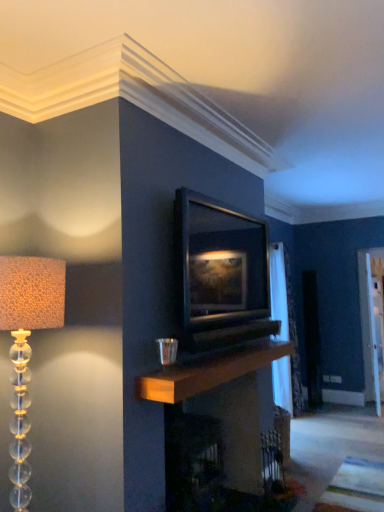
The image size is (384, 512). Find the location of `white sheer curtain at right`. white sheer curtain at right is located at coordinates (285, 333).

This screenshot has height=512, width=384. Describe the element at coordinates (209, 370) in the screenshot. I see `wooden mantle at center` at that location.

Find the location of a particular element. The width and height of the screenshot is (384, 512). wooden mantle at center is located at coordinates (209, 370).

This screenshot has height=512, width=384. In order to click on matte black picture frame at center in this screenshot , I will do `click(220, 273)`.

Can you confirm if transparent glass door at right is shorter than translucent glass lampshade at left?

No.

Is transparent glass door at right looking in the opposite direction of translucent glass lampshade at left?

transparent glass door at right is not turned away from translucent glass lampshade at left.

Is transparent glass door at right at the left side of translucent glass lampshade at left?

No, transparent glass door at right is not to the left of translucent glass lampshade at left.

Is transparent glass door at right far away from translucent glass lampshade at left?

transparent glass door at right is far away from translucent glass lampshade at left.

In the image, is translucent glass lampshade at left positioned in front of or behind matte black picture frame at center?

Visually, translucent glass lampshade at left is located in front of matte black picture frame at center.

From the image's perspective, is translucent glass lampshade at left located above or below matte black picture frame at center?

Based on their image positions, translucent glass lampshade at left is located beneath matte black picture frame at center.

Does translucent glass lampshade at left have a lesser width compared to matte black picture frame at center?

Incorrect, the width of translucent glass lampshade at left is not less than that of matte black picture frame at center.

Would you say translucent glass lampshade at left is inside or outside matte black picture frame at center?

translucent glass lampshade at left is not inside matte black picture frame at center, it's outside.

Looking at this image, from a real-world perspective, is white sheer curtain at right above or below transparent glass door at right?

From a real-world perspective, white sheer curtain at right is physically above transparent glass door at right.

Is point (273, 311) behind point (371, 268)?

No.

Between white sheer curtain at right and transparent glass door at right, which one has less height?

With less height is transparent glass door at right.

Between wooden mantle at center and transparent glass door at right, which one appears on the left side from the viewer's perspective?

wooden mantle at center is more to the left.

Is wooden mantle at center not inside transparent glass door at right?

Yes.

Is wooden mantle at center wider or thinner than transparent glass door at right?

In the image, wooden mantle at center appears to be wider than transparent glass door at right.

Is wooden mantle at center taller or shorter than transparent glass door at right?

Considering their sizes, wooden mantle at center has less height than transparent glass door at right.

Does translucent glass lampshade at left have a greater width compared to transparent glass door at right?

Indeed, translucent glass lampshade at left has a greater width compared to transparent glass door at right.

Can you confirm if translucent glass lampshade at left is positioned to the left of transparent glass door at right?

Yes, translucent glass lampshade at left is to the left of transparent glass door at right.

Which object is more forward, translucent glass lampshade at left or transparent glass door at right?

translucent glass lampshade at left is in front.

Would you consider translucent glass lampshade at left to be distant from transparent glass door at right?

Yes.

Is wooden mantle at center positioned beyond the bounds of translucent glass lampshade at left?

Yes.

From a real-world perspective, is wooden mantle at center above or below translucent glass lampshade at left?

wooden mantle at center is below translucent glass lampshade at left.

Which of these two, wooden mantle at center or translucent glass lampshade at left, is wider?

translucent glass lampshade at left is wider.

Does wooden mantle at center come behind translucent glass lampshade at left?

Yes, wooden mantle at center is behind translucent glass lampshade at left.

Who is more distant, transparent glass door at right or matte black picture frame at center?

transparent glass door at right is further away from the camera.

You are a GUI agent. You are given a task and a screenshot of the screen. Output one action in this format:
    pyautogui.click(x=<x>, y=<y>)
    Task: Click on the glass door located on the right of matte black picture frame at center
    The height and width of the screenshot is (512, 384).
    Given the screenshot: What is the action you would take?
    pyautogui.click(x=372, y=320)

Which object is thinner, transparent glass door at right or matte black picture frame at center?

With smaller width is transparent glass door at right.

How many degrees apart are the facing directions of transparent glass door at right and matte black picture frame at center?

12.4 degrees separate the facing orientations of transparent glass door at right and matte black picture frame at center.

Locate an element on the screen. The image size is (384, 512). glass door below the translucent glass lampshade at left (from a real-world perspective) is located at coordinates (372, 320).

Image resolution: width=384 pixels, height=512 pixels. What are the coordinates of `picture frame on the right of translucent glass lampshade at left` in the screenshot? It's located at (220, 273).

When comparing their distances from white sheer curtain at right, does matte black picture frame at center or wooden mantle at center seem further?

The object further to white sheer curtain at right is matte black picture frame at center.

Considering their positions, is matte black picture frame at center positioned closer to white sheer curtain at right than translucent glass lampshade at left?

Among the two, matte black picture frame at center is located nearer to white sheer curtain at right.

From the image, which object appears to be farther from white sheer curtain at right, wooden mantle at center or matte black picture frame at center?

The object further to white sheer curtain at right is matte black picture frame at center.

Looking at the image, which one is located closer to matte black picture frame at center, translucent glass lampshade at left or white sheer curtain at right?

Among the two, translucent glass lampshade at left is located nearer to matte black picture frame at center.

When comparing their distances from transparent glass door at right, does wooden mantle at center or matte black picture frame at center seem further?

matte black picture frame at center is positioned further to the anchor transparent glass door at right.

When comparing their distances from translucent glass lampshade at left, does matte black picture frame at center or transparent glass door at right seem closer?

matte black picture frame at center.

Considering their positions, is transparent glass door at right positioned further to white sheer curtain at right than wooden mantle at center?

The object further to white sheer curtain at right is wooden mantle at center.

Considering their positions, is matte black picture frame at center positioned closer to translucent glass lampshade at left than wooden mantle at center?

Based on the image, wooden mantle at center appears to be nearer to translucent glass lampshade at left.

Locate an element on the screen. curtain located between translucent glass lampshade at left and transparent glass door at right in the depth direction is located at coordinates (285, 333).

Where is `mantle between translucent glass lampshade at left and white sheer curtain at right along the z-axis`? The width and height of the screenshot is (384, 512). mantle between translucent glass lampshade at left and white sheer curtain at right along the z-axis is located at coordinates (209, 370).

Find the location of a particular element. This screenshot has width=384, height=512. curtain positioned between wooden mantle at center and transparent glass door at right from near to far is located at coordinates (285, 333).

Where is `picture frame between translucent glass lampshade at left and transparent glass door at right from front to back`? This screenshot has height=512, width=384. picture frame between translucent glass lampshade at left and transparent glass door at right from front to back is located at coordinates (220, 273).